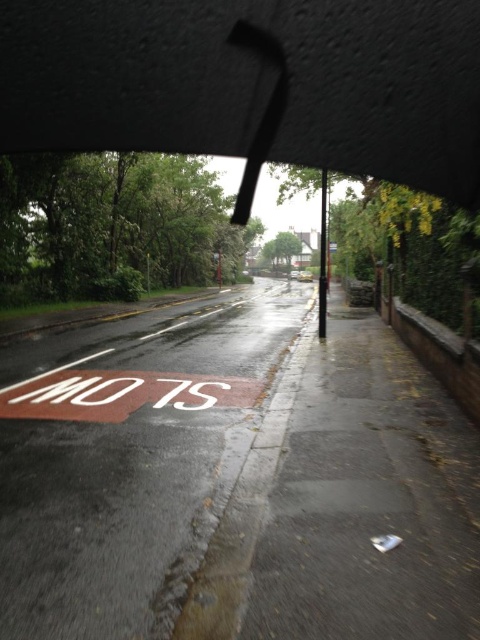
Question: Is transparent plastic umbrella at upper center above metallic silver car at center?

Choices:
 (A) yes
 (B) no

Answer: (B)

Question: Which point is closer to the camera?

Choices:
 (A) (309, 273)
 (B) (290, 278)

Answer: (B)

Question: Based on their relative distances, which object is nearer to the yellow matte car at center?

Choices:
 (A) transparent plastic umbrella at upper center
 (B) metallic silver car at center

Answer: (B)

Question: Which object is the farthest from the metallic silver car at center?

Choices:
 (A) transparent plastic umbrella at upper center
 (B) yellow matte car at center

Answer: (A)

Question: Is yellow matte car at center above metallic silver car at center?

Choices:
 (A) no
 (B) yes

Answer: (A)

Question: In this image, where is transparent plastic umbrella at upper center located relative to metallic silver car at center?

Choices:
 (A) below
 (B) above

Answer: (A)